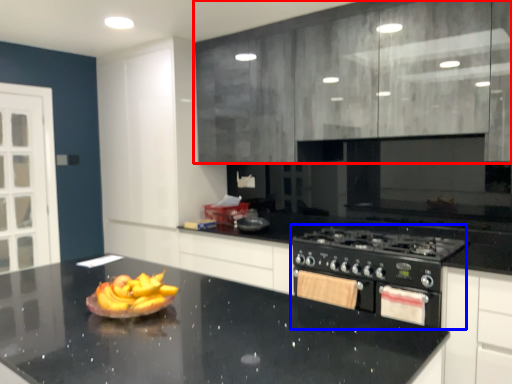
Question: Which object is closer to the camera taking this photo, cabinetry (highlighted by a red box) or appliance (highlighted by a blue box)?

Choices:
 (A) cabinetry
 (B) appliance

Answer: (A)